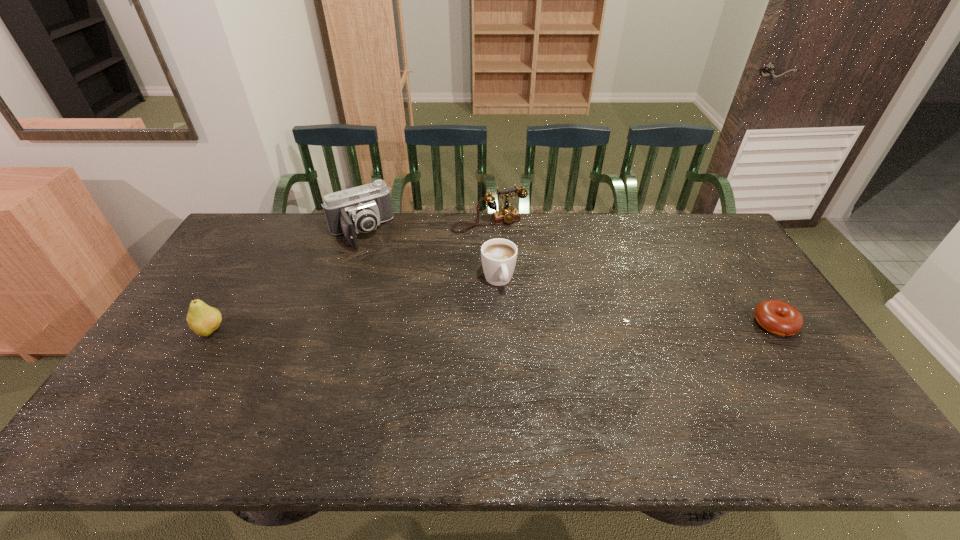
The image size is (960, 540). In order to click on vacant spot on the desktop that is between the pear and the shortest object and is positioned on the front-facing side of the telephone in this screenshot , I will do 547,326.

Locate an element on the screen. The width and height of the screenshot is (960, 540). vacant space on the desktop that is between the leftmost object and the shortest object and is positioned with the handle on the side of the cappuccino is located at coordinates (516, 327).

This screenshot has width=960, height=540. I want to click on vacant space on the desktop that is between the pear and the doughnut and is positioned at the front of the fourth object from right to left with an open lens cover, so click(416, 328).